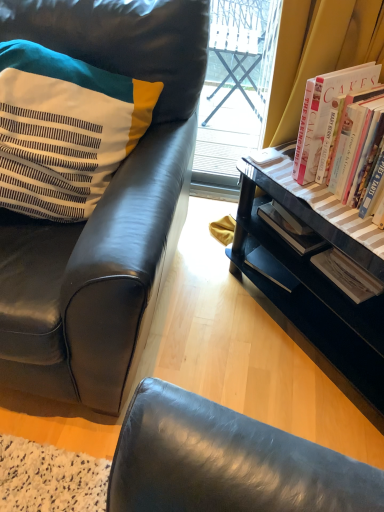
Question: Is black leather chair at left outside black wood desk at lower right?

Choices:
 (A) no
 (B) yes

Answer: (B)

Question: Is black leather chair at left smaller than black wood desk at lower right?

Choices:
 (A) no
 (B) yes

Answer: (A)

Question: From the image's perspective, would you say black leather chair at left is shown under black wood desk at lower right?

Choices:
 (A) no
 (B) yes

Answer: (A)

Question: From the image's perspective, does black leather chair at left appear higher than black wood desk at lower right?

Choices:
 (A) no
 (B) yes

Answer: (B)

Question: Could you tell me if black leather chair at left is turned towards black wood desk at lower right?

Choices:
 (A) yes
 (B) no

Answer: (B)

Question: Is black leather chair at left to the right of black wood desk at lower right from the viewer's perspective?

Choices:
 (A) no
 (B) yes

Answer: (A)

Question: From a real-world perspective, is black wood desk at lower right beneath striped fabric pillow at left?

Choices:
 (A) no
 (B) yes

Answer: (B)

Question: Is black wood desk at lower right oriented towards striped fabric pillow at left?

Choices:
 (A) no
 (B) yes

Answer: (A)

Question: From a real-world perspective, does black wood desk at lower right stand above striped fabric pillow at left?

Choices:
 (A) no
 (B) yes

Answer: (A)

Question: Is black wood desk at lower right to the left of striped fabric pillow at left from the viewer's perspective?

Choices:
 (A) no
 (B) yes

Answer: (A)

Question: Is black wood desk at lower right not inside striped fabric pillow at left?

Choices:
 (A) no
 (B) yes

Answer: (B)

Question: Does black wood desk at lower right have a greater height compared to striped fabric pillow at left?

Choices:
 (A) yes
 (B) no

Answer: (A)

Question: Is black wood desk at lower right at the right side of black leather chair at left?

Choices:
 (A) yes
 (B) no

Answer: (A)